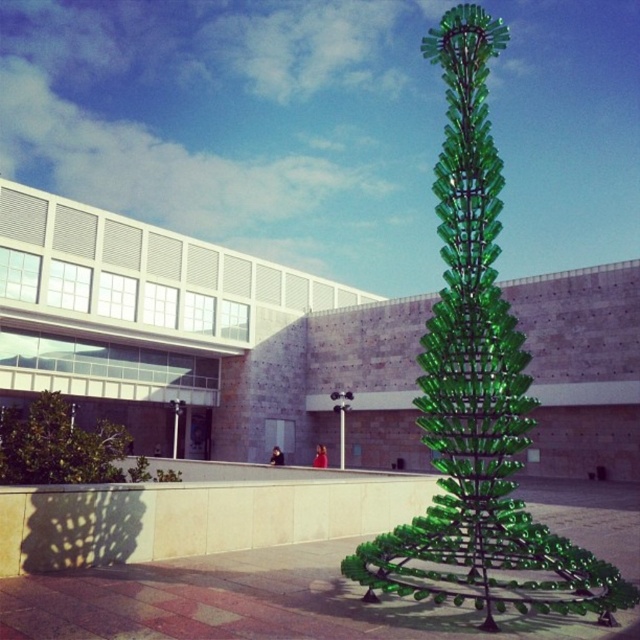
You are a landscape architect planning to install a new pathway between the green glass sculpture at center and the green glass tree at lower left. The pathway must be at least 1 meter wide to accommodate visitors. Can the pathway fit between them given their current spacing?

The green glass sculpture at center and green glass tree at lower left are 9.33 meters apart from each other, so yes, a 1 meter wide pathway can easily fit between them as the distance is more than sufficient.

You are a visitor at the sculpture garden and want to take a photo of both the green glass sculpture at center and the green glass tree at lower left. Which one should you focus on first if you want to ensure both are in the frame?

You should focus on the green glass sculpture at center first because it is much taller than the green glass tree at lower left, so it will occupy more space in the photo and help frame the composition better.

You are standing at the entrance of the building in the background and want to take a photo of the green glass sculpture at center. Based on its position, where should you aim your camera to capture it in the frame?

The green glass sculpture at center is located at coordinates point (477, 392), so you should aim your camera slightly to the right and lower down to capture it in the frame.